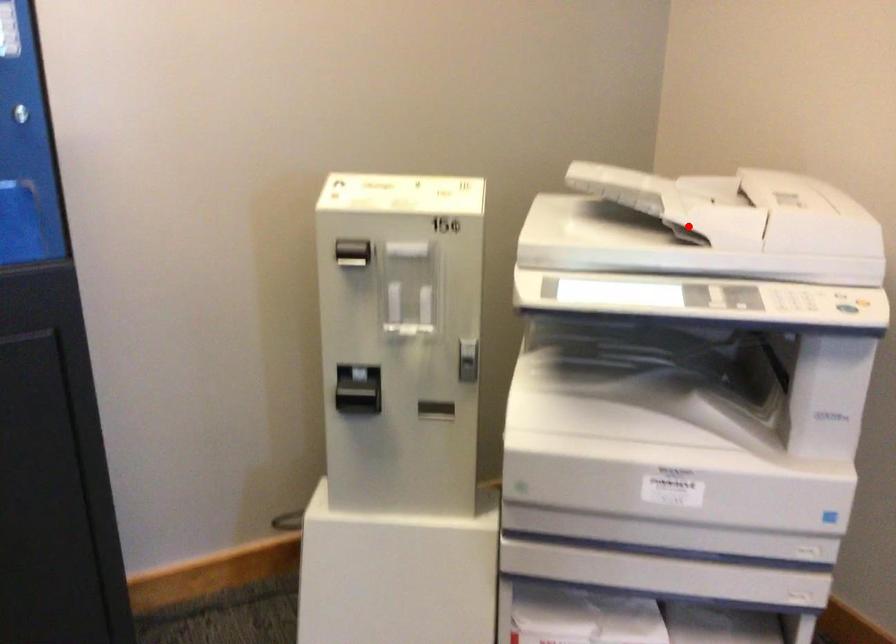
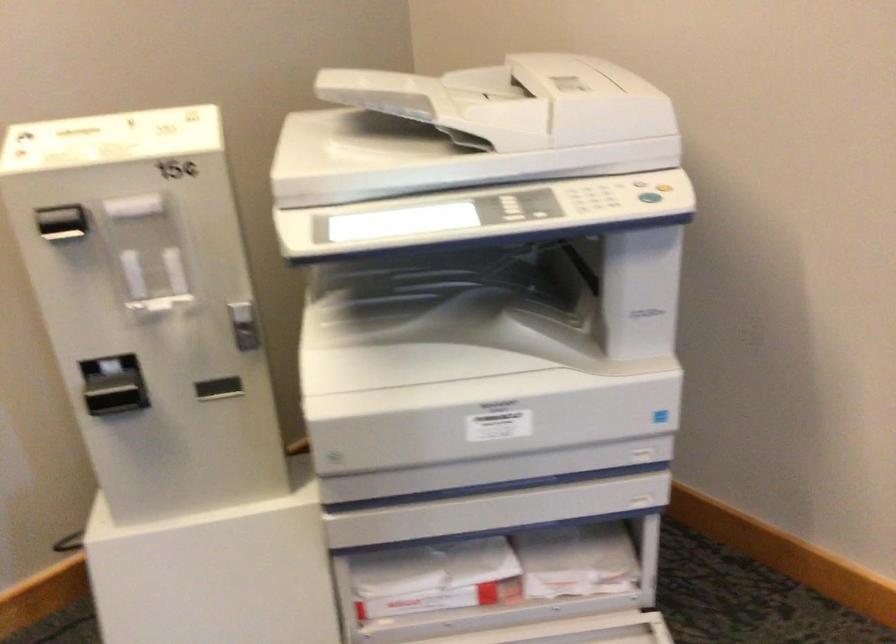
Locate, in the second image, the point that corresponds to the highlighted location in the first image.

(470, 129)